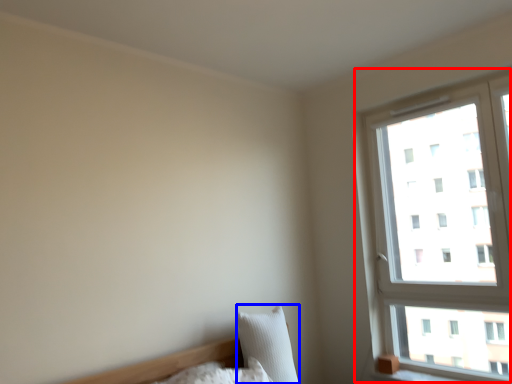
Question: Which object appears farthest to the camera in this image, window (highlighted by a red box) or pillow (highlighted by a blue box)?

Choices:
 (A) window
 (B) pillow

Answer: (B)